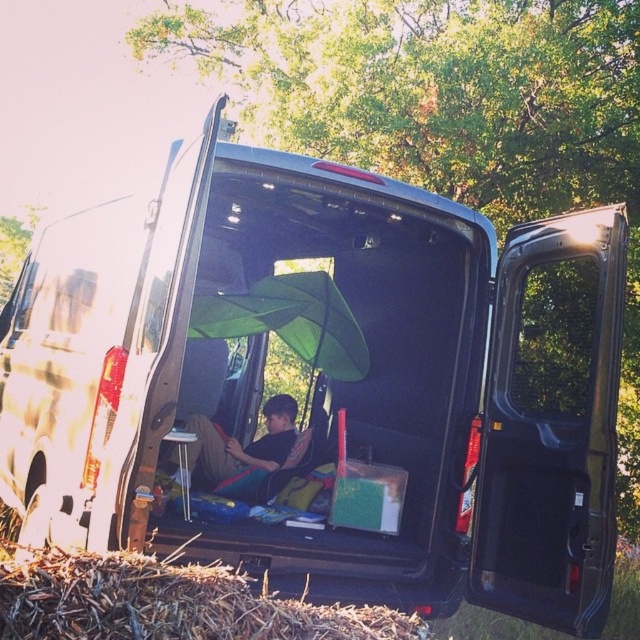
You are packing a backpack for a short camping trip and have to choose between the brown straw at lower left and the black fabric at center. Which item is shorter and would take up less vertical space in your backpack?

The brown straw at lower left is not as tall as the black fabric at center, so it would take up less vertical space in your backpack.

You are standing outside the open rear doors of the van and want to reach both points inside. Which point, point (x=410, y=634) or point (x=225, y=456), is closer to you?

Point (x=410, y=634) is closer to you than point (x=225, y=456).

You are standing outside the open rear doors of the van and want to place a small item on the brown straw at lower left and the black fabric at center. Which surface is easier to reach without moving your position?

The brown straw at lower left is closer to the viewer than the black fabric at center, so it is easier to reach without moving your position.